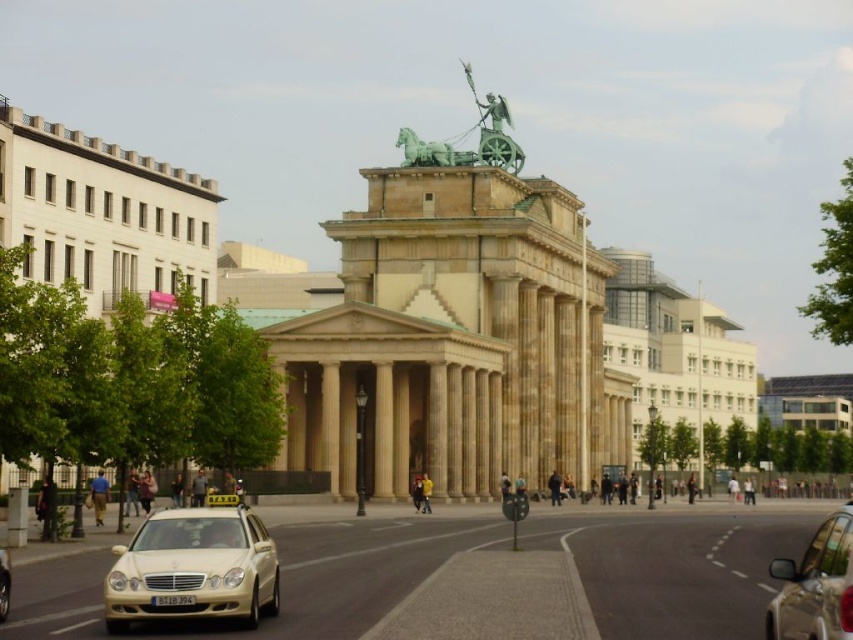
Question: Considering the relative positions of green polished metal chariot at center and gold metallic taxi at center in the image provided, where is green polished metal chariot at center located with respect to gold metallic taxi at center?

Choices:
 (A) right
 (B) left

Answer: (A)

Question: Which point is farther to the camera?

Choices:
 (A) (405, 145)
 (B) (500, 109)
 (C) (7, 604)

Answer: (B)

Question: Which object is the closest to the white glossy taxi at lower left?

Choices:
 (A) metallic silver car at lower right
 (B) green polished bronze horse-drawn chariot at center

Answer: (A)

Question: Does metallic silver car at lower right appear over gold metallic taxi at center?

Choices:
 (A) yes
 (B) no

Answer: (B)

Question: Which point is closer to the camera taking this photo?

Choices:
 (A) (227, 544)
 (B) (834, 604)
 (C) (503, 112)

Answer: (B)

Question: Where is metallic silver car at lower right located in relation to green polished stone statue at upper center in the image?

Choices:
 (A) below
 (B) above

Answer: (A)